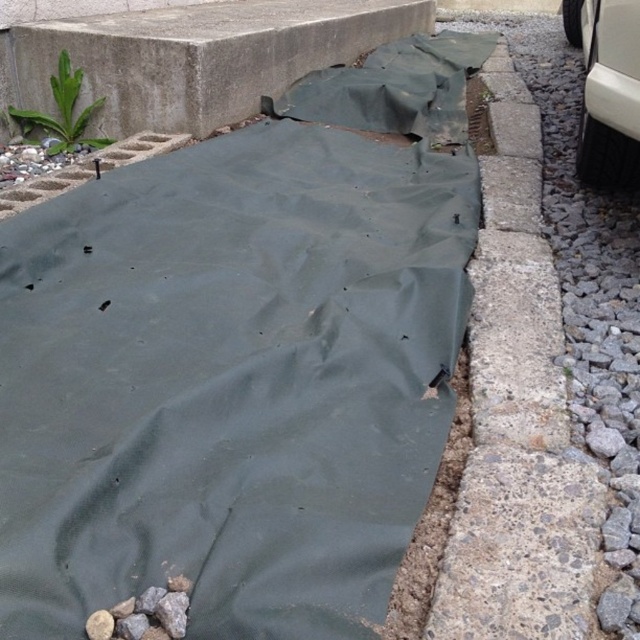
From the picture: You are standing in a construction area and want to reach the paved area near the concrete step to your left. The dark green tarp at center is in your way. Can you step over it if your maximum stepping distance is 36 inches?

The distance between you and the dark green tarp at center is 37.41 inches, which exceeds your maximum stepping distance of 36 inches. Therefore, you cannot step over the dark green tarp at center.

Where is the dark green tarp at center located in the image?

The dark green tarp at center is located at point (241, 360) in the image.

You are a contractor working on a landscaping project. You need to place a new decorative stone border along the edge of the dark green tarp at center and the gray concrete curb at right. Based on their positions, which object should you start working near first?

The dark green tarp at center is positioned on the left side of the gray concrete curb at right, so you should start working near the dark green tarp at center first since it is closer to the left edge where the stone border needs to be placed.